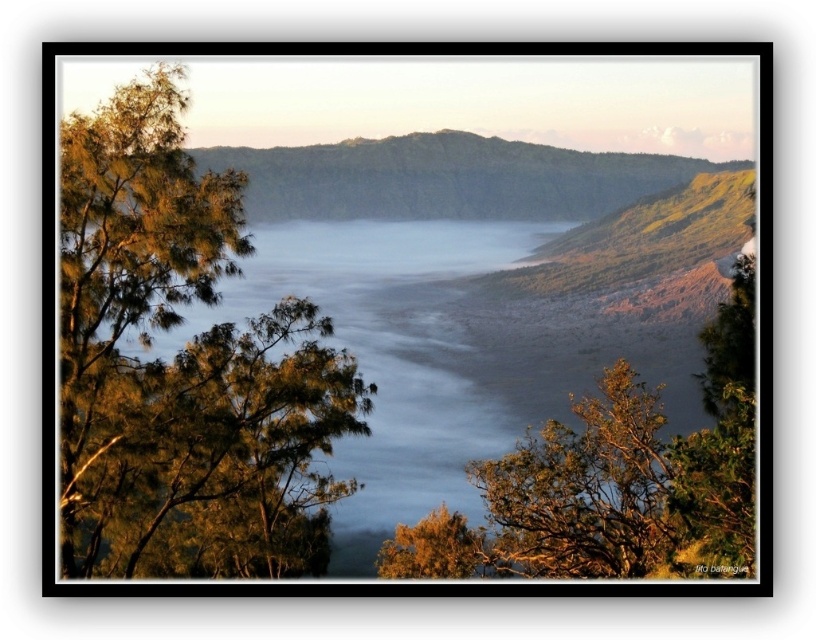
Is green leafy tree at left thinner than green grassy hill at center?

Correct, green leafy tree at left's width is less than green grassy hill at center's.

Between green leafy tree at left and green grassy hill at center, which one is positioned lower?

green leafy tree at left is below.

Locate an element on the screen. green leafy tree at left is located at coordinates (182, 365).

Between green leafy tree at left and green leafy tree at lower center, which one has less height?

green leafy tree at lower center is shorter.

From the picture: Can you confirm if green leafy tree at left is smaller than green leafy tree at lower center?

Actually, green leafy tree at left might be larger than green leafy tree at lower center.

Is point (107, 524) closer to camera compared to point (432, 572)?

That is True.

This screenshot has height=640, width=816. What are the coordinates of `green leafy tree at left` in the screenshot? It's located at (182, 365).

Does green grassy hill at center have a smaller size compared to green leafy tree at lower center?

Actually, green grassy hill at center might be larger than green leafy tree at lower center.

Can you confirm if green grassy hill at center is wider than green leafy tree at lower center?

Correct, the width of green grassy hill at center exceeds that of green leafy tree at lower center.

Is point (455, 192) more distant than point (384, 541)?

Yes.

Identify the location of green grassy hill at center. The height and width of the screenshot is (640, 816). [446, 179].